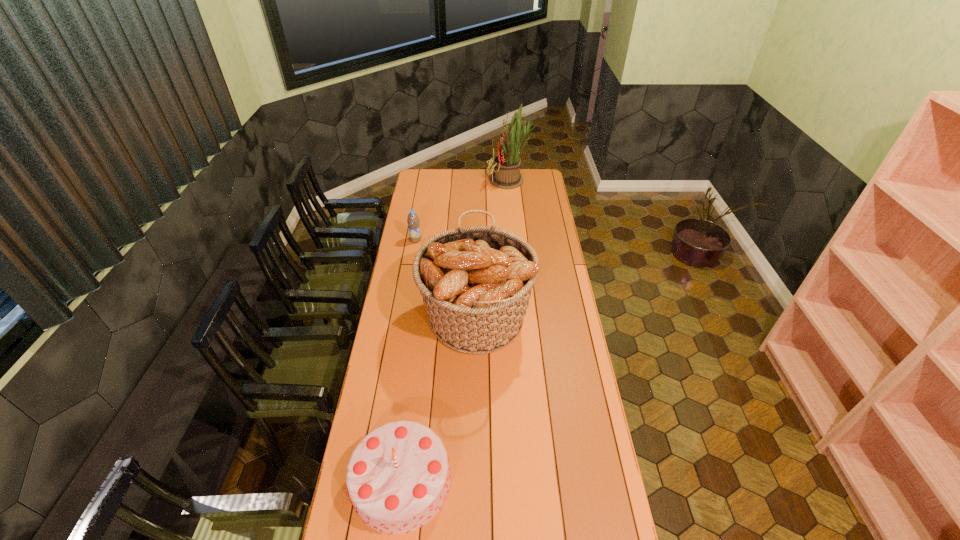
This screenshot has height=540, width=960. What are the coordinates of `flower arrangement` in the screenshot? It's located at (506, 166).

The image size is (960, 540). Find the location of `the farthest object`. the farthest object is located at coordinates (506, 166).

The height and width of the screenshot is (540, 960). What are the coordinates of `the second nearest object` in the screenshot? It's located at (476, 282).

Identify the location of basket. (476, 282).

Image resolution: width=960 pixels, height=540 pixels. I want to click on the nearest object, so click(398, 477).

Locate an element on the screen. The image size is (960, 540). birthday cake is located at coordinates (398, 477).

What are the coordinates of `the shortest object` in the screenshot? It's located at (413, 221).

Locate an element on the screen. This screenshot has height=540, width=960. the third nearest object is located at coordinates (413, 221).

Identify the location of free location located 0.100m in front of the tallest object with the fan visible. The image size is (960, 540). (471, 181).

Where is `vacant point located in front of the tallest object with the fan visible`? This screenshot has width=960, height=540. vacant point located in front of the tallest object with the fan visible is located at coordinates (440, 181).